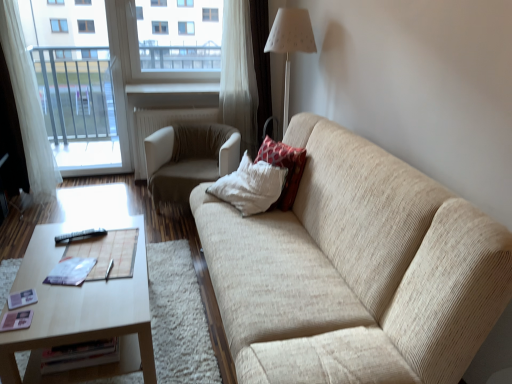
Question: In terms of height, does beige fabric chair at center look taller or shorter compared to light brown wooden coffee table at lower left?

Choices:
 (A) tall
 (B) short

Answer: (A)

Question: From a real-world perspective, is beige fabric chair at center positioned above or below light brown wooden coffee table at lower left?

Choices:
 (A) below
 (B) above

Answer: (B)

Question: Which is farther from the beige fabric chair at center?

Choices:
 (A) white fabric lampshade at upper center
 (B) white sheer curtain at left
 (C) red textured pillow at upper right
 (D) light brown wooden coffee table at lower left
 (E) transparent glass window at upper center

Answer: (D)

Question: Which object is the farthest from the beige fabric couch at center?

Choices:
 (A) beige fabric chair at center
 (B) transparent glass window at upper center
 (C) white sheer curtain at left
 (D) white fabric lampshade at upper center
 (E) red textured pillow at upper right

Answer: (C)